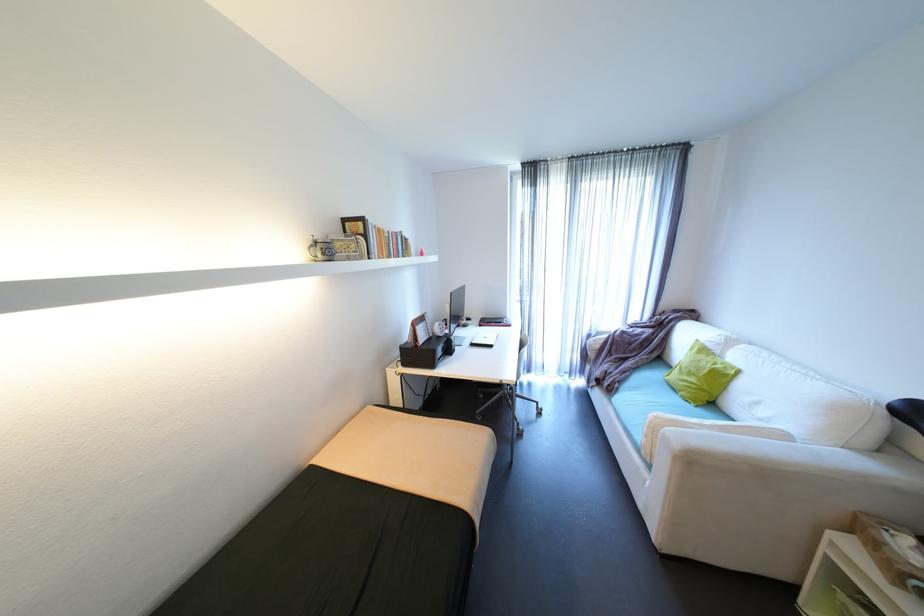
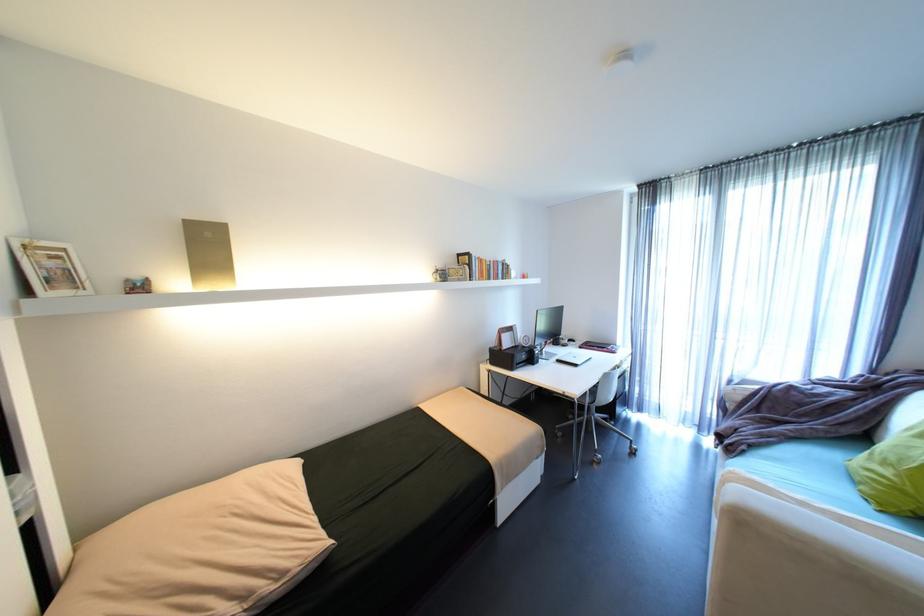
Locate, in the second image, the point that corresponds to (x=398, y=233) in the first image.

(500, 262)